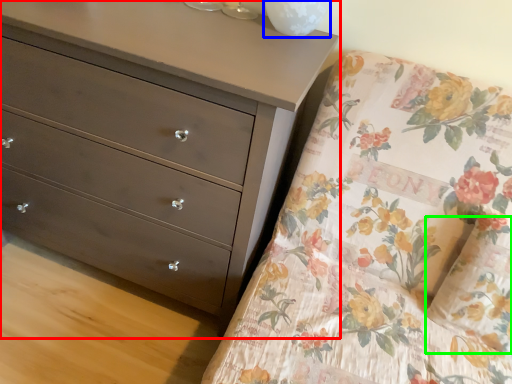
Question: Based on their relative distances, which object is farther from chest of drawers (highlighted by a red box)? Choose from glass vase (highlighted by a blue box) and pillow (highlighted by a green box).

Choices:
 (A) glass vase
 (B) pillow

Answer: (B)